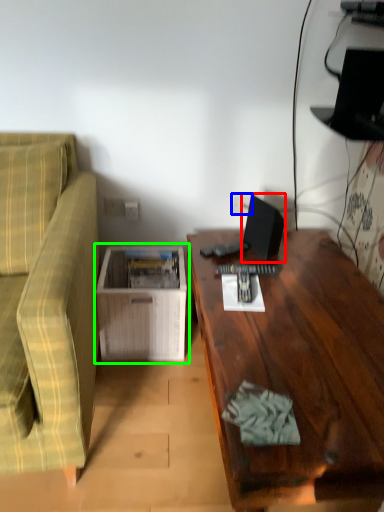
Question: Which is nearer to the computer monitor (highlighted by a red box)? electric outlet (highlighted by a blue box) or table (highlighted by a green box).

Choices:
 (A) electric outlet
 (B) table

Answer: (A)